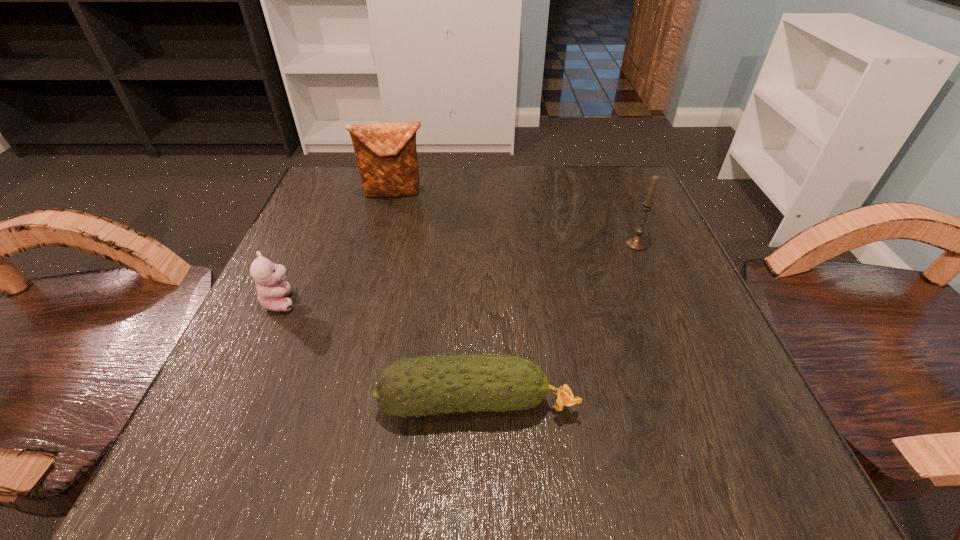
You are a GUI agent. You are given a task and a screenshot of the screen. Output one action in this format:
    pyautogui.click(x=<x>, y=<y>)
    Task: Click on the free area in between the teddy bear and the candle
    The image size is (960, 540).
    Given the screenshot: What is the action you would take?
    pyautogui.click(x=459, y=272)

The height and width of the screenshot is (540, 960). Find the location of `free space between the clutch bag and the rightmost object`. free space between the clutch bag and the rightmost object is located at coordinates (516, 218).

What are the coordinates of `free space between the third nearest object and the cucumber` in the screenshot? It's located at (557, 323).

At what (x,y) coordinates should I click in order to perform the action: click on free spot between the teddy bear and the third nearest object. Please return your answer as a coordinate pair (x, y). Looking at the image, I should click on (459, 272).

In order to click on object that is the second closest to the clutch bag in this screenshot , I will do `click(637, 242)`.

Choose which object is the nearest neighbor to the farthest object. Please provide its 2D coordinates. Your answer should be formatted as a tuple, i.e. [(x, y)], where the tuple contains the x and y coordinates of a point satisfying the conditions above.

[(269, 278)]

At what (x,y) coordinates should I click in order to perform the action: click on blank space that satisfies the following two spatial constraints: 1. on the open side of the farthest object; 2. on the left side of the rightmost object. Please return your answer as a coordinate pair (x, y). Image resolution: width=960 pixels, height=540 pixels. Looking at the image, I should click on (381, 243).

Identify the location of free location that satisfies the following two spatial constraints: 1. on the front side of the candle; 2. at the blossom end of the cucumber. (702, 402).